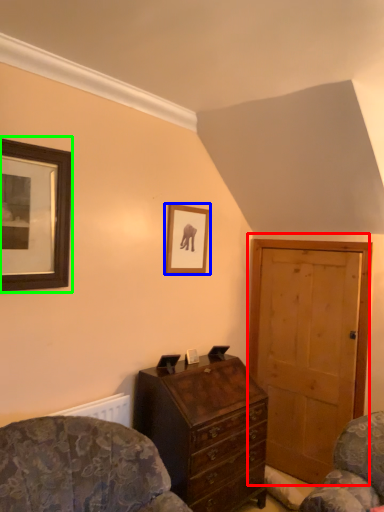
Question: Considering the real-world distances, which object is farthest from door (highlighted by a red box)? picture frame (highlighted by a blue box) or picture frame (highlighted by a green box)?

Choices:
 (A) picture frame
 (B) picture frame

Answer: (B)